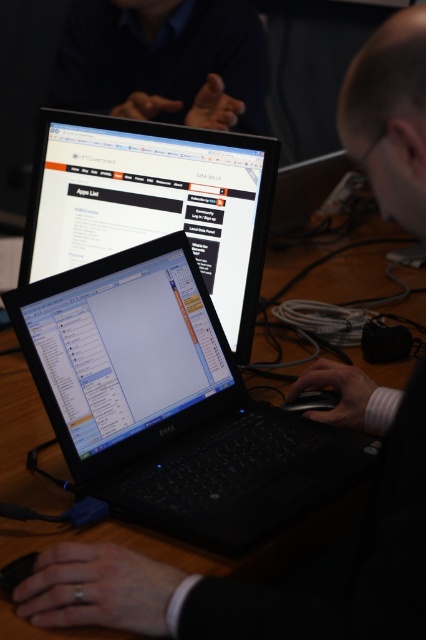
You are a photographer standing at a distance of 30 inches from the black matte laptop at center. You want to take a clear photo of it without moving the laptop. Is your current position sufficient to capture the laptop in focus?

The black matte laptop at center is 31.17 inches away from the camera. Since you are standing at 30 inches, you are slightly closer than the actual distance required. Move back approximately 1.17 inches to align with the laptop distance for clear focus.

You are a photographer trying to capture a closeup of the Dell laptop screen. You have two points marked on the table where you can place your camera. The first point is at coordinate point (298, 512) and the second is at point (190, 84). Which point should you choose to get the closest view of the Dell laptop screen?

Point (298, 512) is closer to the camera than point (190, 84), so you should choose point (298, 512) to get the closest view of the Dell laptop screen.

You are standing 5 feet away from the wooden table where the Dell laptop is placed. You want to reach the point at coordinates point (31, 250) on the table. Can you reach it without moving closer?

The point (31, 250) is 4.37 feet from the viewer. Since you are standing 5 feet away, you are farther than the required distance. You can reach it without moving closer.